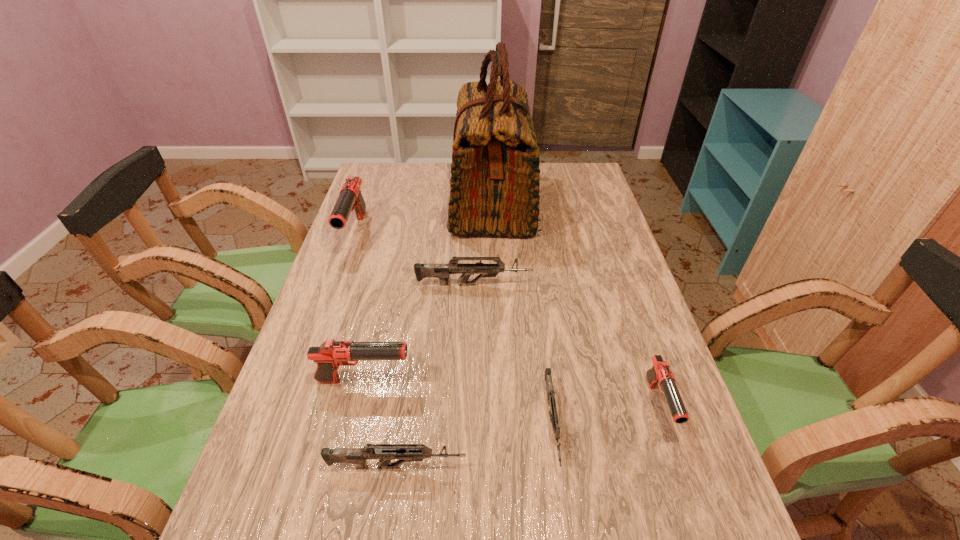
Where is `vacant space in between the second tallest object and the second biggest black gun`? The width and height of the screenshot is (960, 540). vacant space in between the second tallest object and the second biggest black gun is located at coordinates (360, 307).

Identify the location of unoccupied area between the second smallest black gun and the rightmost gun. This screenshot has width=960, height=540. (511, 393).

Locate an element on the screen. This screenshot has height=540, width=960. vacant space in between the shortest gun and the third tallest object is located at coordinates (458, 402).

I want to click on unoccupied area between the shopping bag and the smallest grey gun, so click(x=522, y=313).

Identify the location of free point between the fifth tallest gun and the tallest object. This screenshot has height=540, width=960. (445, 334).

Find the location of `vacant region between the shortest object and the second black gun from left to right`. vacant region between the shortest object and the second black gun from left to right is located at coordinates (458, 402).

Point out which object is positioned as the nearest to the rightmost object. Please provide its 2D coordinates. Your answer should be formatted as a tuple, i.e. [(x, y)], where the tuple contains the x and y coordinates of a point satisfying the conditions above.

[(553, 415)]

Select which object appears as the closest to the rightmost black gun. Please provide its 2D coordinates. Your answer should be formatted as a tuple, i.e. [(x, y)], where the tuple contains the x and y coordinates of a point satisfying the conditions above.

[(553, 415)]

You are a GUI agent. You are given a task and a screenshot of the screen. Output one action in this format:
    pyautogui.click(x=<x>, y=<y>)
    Task: Click on the gun that is the closest to the leftmost gun
    The width and height of the screenshot is (960, 540).
    Given the screenshot: What is the action you would take?
    click(442, 271)

Locate which gun ranks third in proximity to the second biggest black gun. Please provide its 2D coordinates. Your answer should be formatted as a tuple, i.e. [(x, y)], where the tuple contains the x and y coordinates of a point satisfying the conditions above.

[(553, 415)]